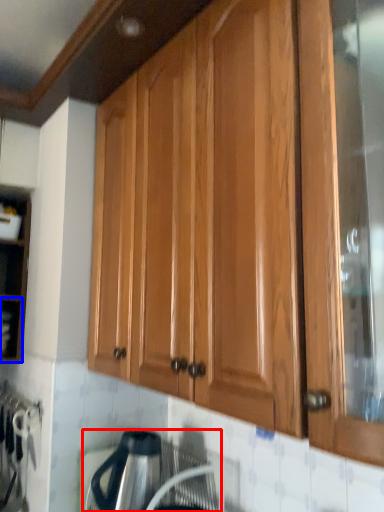
Question: Which of the following is the closest to the observer, appliance (highlighted by a red box) or shelf (highlighted by a blue box)?

Choices:
 (A) appliance
 (B) shelf

Answer: (A)